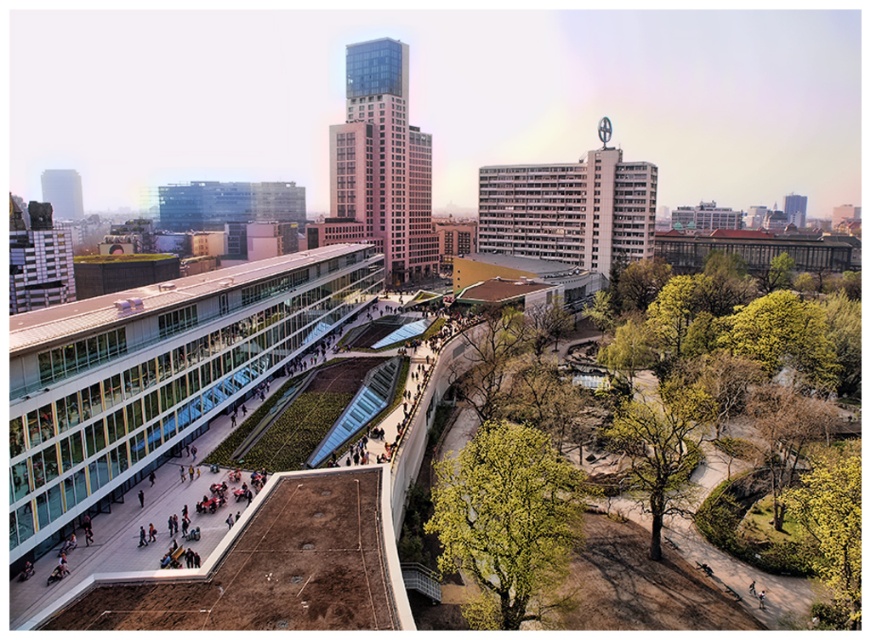
Question: Among these points, which one is farthest from the camera?

Choices:
 (A) (680, 474)
 (B) (835, 554)
 (C) (498, 499)

Answer: (A)

Question: Does green leafy tree at lower right have a lesser width compared to yellow-green leafy tree at lower right?

Choices:
 (A) no
 (B) yes

Answer: (B)

Question: Which of the following is the closest to the observer?

Choices:
 (A) (674, 387)
 (B) (584, 492)
 (C) (847, 538)

Answer: (C)

Question: Does green leafy tree at center appear on the right side of yellow-green leafy tree at lower right?

Choices:
 (A) yes
 (B) no

Answer: (B)

Question: Is green leafy tree at lower right thinner than yellow-green leafy tree at lower right?

Choices:
 (A) no
 (B) yes

Answer: (B)

Question: Which point is farther to the camera?

Choices:
 (A) (638, 413)
 (B) (861, 506)

Answer: (A)